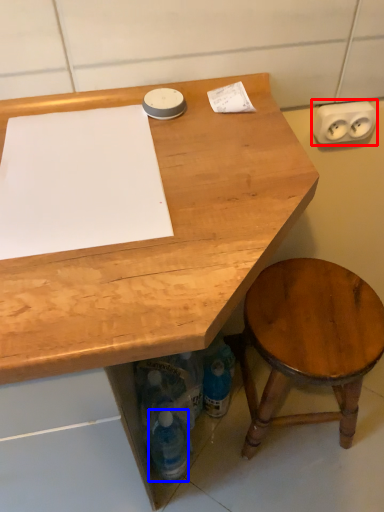
Question: Among these objects, which one is nearest to the camera, electric outlet (highlighted by a red box) or bottle (highlighted by a blue box)?

Choices:
 (A) electric outlet
 (B) bottle

Answer: (A)